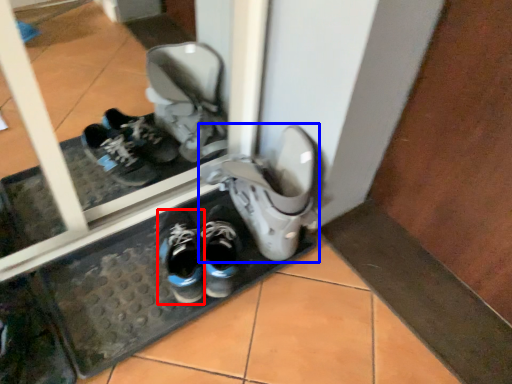
Question: Which object is further to the camera taking this photo, running shoe (highlighted by a red box) or footwear (highlighted by a blue box)?

Choices:
 (A) running shoe
 (B) footwear

Answer: (A)